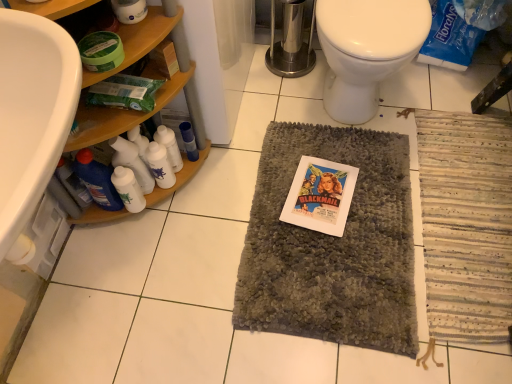
At what (x,y) coordinates should I click in order to perform the action: click on vacant area that lies between gray shaggy mat at center and striped fabric bath mat at lower right. Please return your answer as a coordinate pair (x, y). Image resolution: width=512 pixels, height=384 pixels. Looking at the image, I should click on (381, 130).